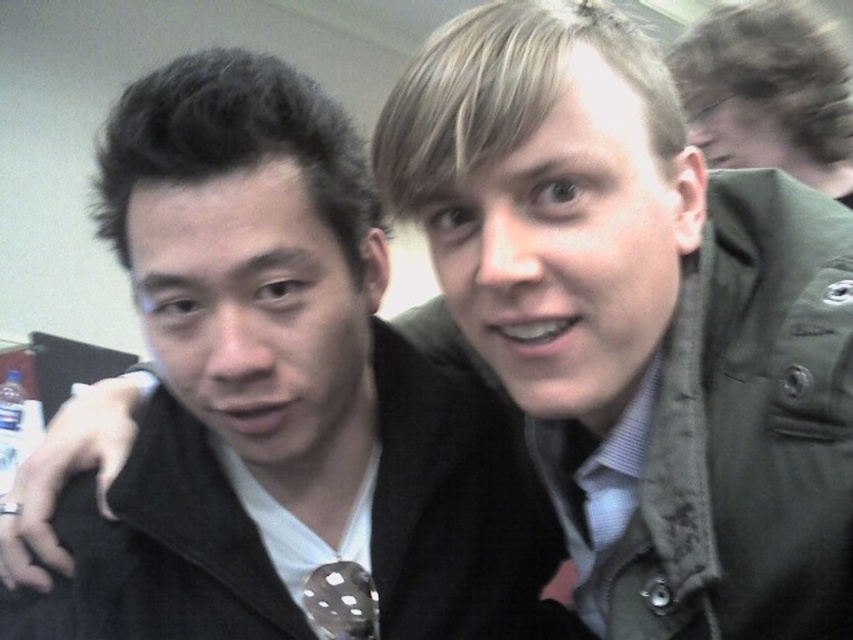
You are standing in front of the two people in the image. There is a point at coordinates (279, 396). What object is located at that point?

The matte black jacket at center is located at point (279, 396).

You are taking a photo with a camera that has a 50 cm focal length. You want to capture the point at point (171, 72) in focus. Is the camera focused correctly?

The point (171, 72) is 51.74 centimeters from the camera, which is just beyond the 50 cm focal length. Therefore, the camera may not be focused correctly as the focal length is shorter than the distance to the point.